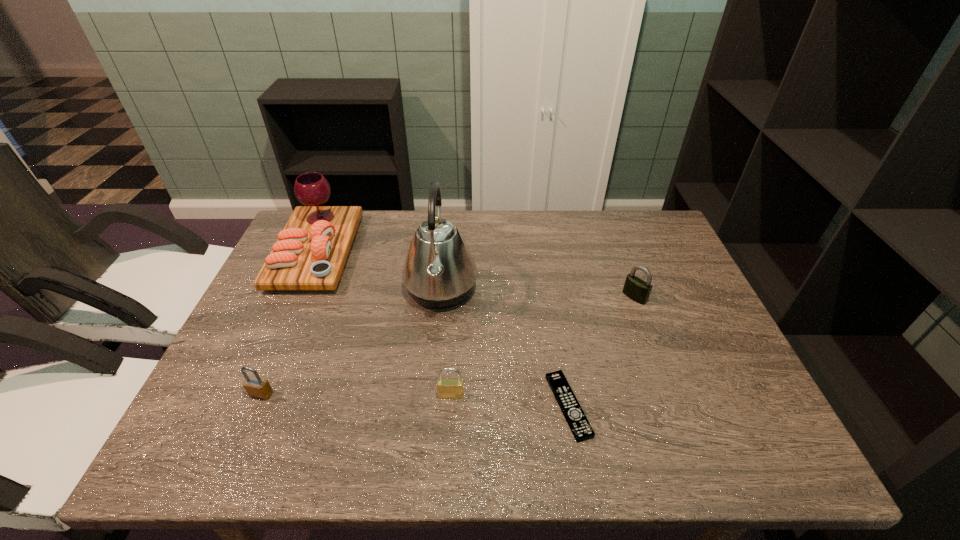
Find the location of a particular element. free space at the far edge is located at coordinates (521, 250).

Image resolution: width=960 pixels, height=540 pixels. What are the coordinates of `free space at the near edge of the desktop` in the screenshot? It's located at (444, 453).

This screenshot has height=540, width=960. What are the coordinates of `vacant area at the left edge of the desktop` in the screenshot? It's located at (246, 392).

In the image, there is a desktop. Where is `free space at the right edge`? The height and width of the screenshot is (540, 960). free space at the right edge is located at coordinates (721, 421).

Locate an element on the screen. This screenshot has width=960, height=540. vacant space at the near left corner of the desktop is located at coordinates (184, 447).

Identify the location of vacant space at the far right corner. The width and height of the screenshot is (960, 540). (641, 243).

Where is `empty location between the second padlock from right to left and the farthest padlock`? empty location between the second padlock from right to left and the farthest padlock is located at coordinates (542, 346).

What are the coordinates of `empty location between the platter and the leftmost padlock` in the screenshot? It's located at (289, 323).

This screenshot has width=960, height=540. What are the coordinates of `blank region between the second padlock from right to left and the rightmost object` in the screenshot? It's located at (542, 346).

The width and height of the screenshot is (960, 540). I want to click on blank region between the farthest padlock and the remote control, so click(x=601, y=352).